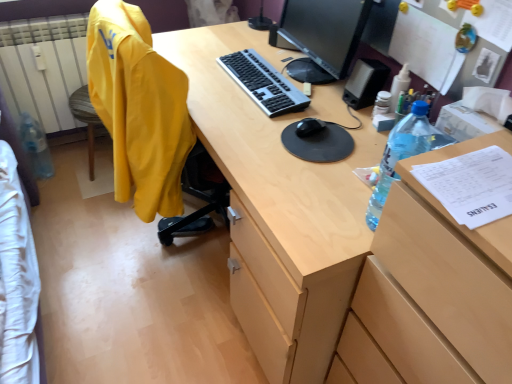
The height and width of the screenshot is (384, 512). In order to click on vacant space situated on the left part of translucent plastic bottle at right, which appears as the first bottle when viewed from the front in this screenshot , I will do `click(320, 216)`.